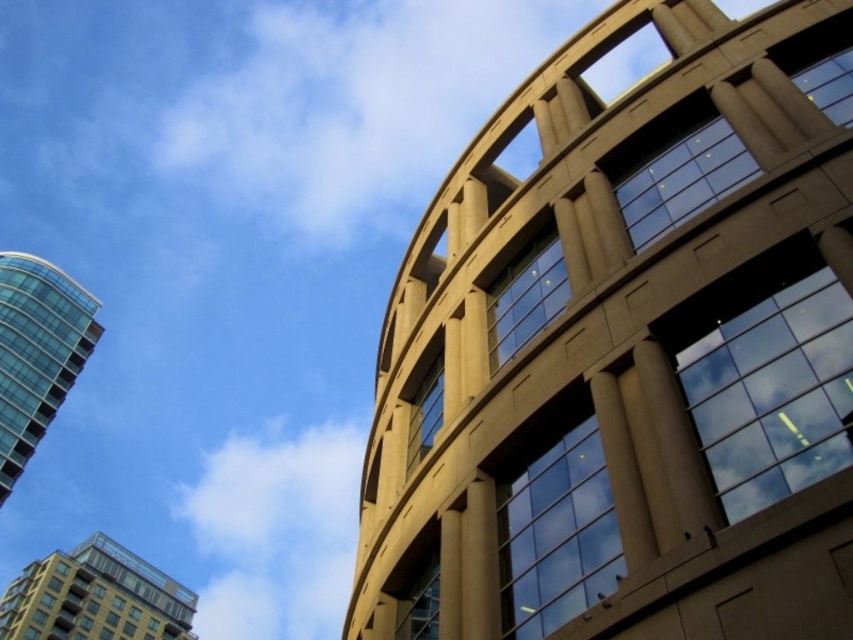
Measure the distance from beige stone building at upper right to glassy teal tower at left.

beige stone building at upper right and glassy teal tower at left are 133.84 meters apart from each other.

Does beige stone building at upper right have a lesser height compared to glassy teal tower at left?

In fact, beige stone building at upper right may be taller than glassy teal tower at left.

Image resolution: width=853 pixels, height=640 pixels. What do you see at coordinates (628, 348) in the screenshot?
I see `beige stone building at upper right` at bounding box center [628, 348].

Where is `beige stone building at upper right`? The height and width of the screenshot is (640, 853). beige stone building at upper right is located at coordinates (628, 348).

From the picture: Who is shorter, glassy teal tower at left or glassy reflective building at lower left?

Standing shorter between the two is glassy reflective building at lower left.

Is point (22, 397) positioned before point (193, 636)?

Yes, point (22, 397) is closer to viewer.

Find the location of a particular element. The width and height of the screenshot is (853, 640). glassy teal tower at left is located at coordinates (36, 353).

Which of these two, beige stone building at upper right or glassy reflective building at lower left, stands taller?

Standing taller between the two is beige stone building at upper right.

Which is in front, point (717, 100) or point (86, 628)?

Point (717, 100) is in front.

Which is behind, point (498, 125) or point (73, 596)?

The point (73, 596) is behind.

Locate an element on the screen. Image resolution: width=853 pixels, height=640 pixels. beige stone building at upper right is located at coordinates (628, 348).